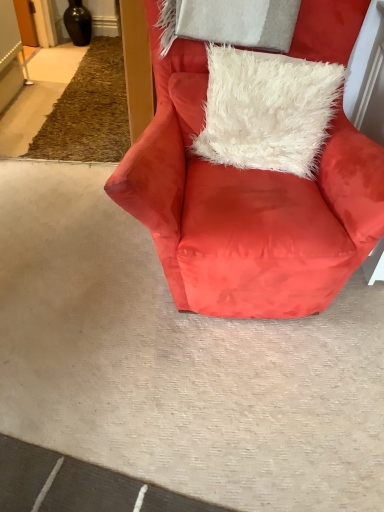
The height and width of the screenshot is (512, 384). Identify the location of white fluffy pillow at center. (267, 110).

Describe the element at coordinates (267, 110) in the screenshot. I see `white fluffy pillow at center` at that location.

Image resolution: width=384 pixels, height=512 pixels. What do you see at coordinates (246, 206) in the screenshot?
I see `satin red armchair at center` at bounding box center [246, 206].

Find the location of a particular element. This screenshot has height=512, width=384. satin red armchair at center is located at coordinates (246, 206).

Measure the distance between point (372, 157) and camera.

1.25 meters.

Where is `white fluffy pillow at center`? This screenshot has height=512, width=384. white fluffy pillow at center is located at coordinates (267, 110).

Is white fluffy pillow at center at the right side of satin red armchair at center?

Yes.

Considering the positions of objects white fluffy pillow at center and satin red armchair at center in the image provided, who is in front, white fluffy pillow at center or satin red armchair at center?

satin red armchair at center is in front.

Is point (308, 137) in front of point (377, 208)?

No, (308, 137) is behind (377, 208).

From the image's perspective, which one is positioned lower, white fluffy pillow at center or satin red armchair at center?

From the image's view, satin red armchair at center is below.

Looking at this image, from a real-world perspective, which object rests below the other?

satin red armchair at center is physically lower.

Is white fluffy pillow at center wider than satin red armchair at center?

No.

In the scene shown: Is white fluffy pillow at center shorter than satin red armchair at center?

Yes.

Between white fluffy pillow at center and satin red armchair at center, which one has smaller size?

Smaller between the two is white fluffy pillow at center.

Consider the image. Is white fluffy pillow at center completely or partially outside of satin red armchair at center?

That's incorrect, white fluffy pillow at center is not completely outside satin red armchair at center.

Is white fluffy pillow at center placed right next to satin red armchair at center?

white fluffy pillow at center and satin red armchair at center are clearly separated.

Is white fluffy pillow at center looking in the opposite direction of satin red armchair at center?

Yes, white fluffy pillow at center's orientation is away from satin red armchair at center.

The width and height of the screenshot is (384, 512). I want to click on chair in front of the white fluffy pillow at center, so click(x=246, y=206).

Is satin red armchair at center at the right side of white fluffy pillow at center?

No, satin red armchair at center is not to the right of white fluffy pillow at center.

Is the depth of satin red armchair at center greater than that of white fluffy pillow at center?

No, satin red armchair at center is closer to the camera.

Which point is more distant from viewer, (155, 243) or (312, 85)?

The point (312, 85) is farther from the camera.

From the image's perspective, relative to white fluffy pillow at center, is satin red armchair at center above or below?

Clearly, from the image's perspective, satin red armchair at center is below white fluffy pillow at center.

From a real-world perspective, relative to white fluffy pillow at center, is satin red armchair at center vertically above or below?

satin red armchair at center is situated lower than white fluffy pillow at center in the real world.

Considering the sizes of objects satin red armchair at center and white fluffy pillow at center in the image provided, who is wider, satin red armchair at center or white fluffy pillow at center?

Wider between the two is satin red armchair at center.

Can you confirm if satin red armchair at center is taller than white fluffy pillow at center?

Yes, satin red armchair at center is taller than white fluffy pillow at center.

Which of these two, satin red armchair at center or white fluffy pillow at center, is smaller?

white fluffy pillow at center is smaller.

From the picture: Does satin red armchair at center contain white fluffy pillow at center?

That's correct, white fluffy pillow at center is inside satin red armchair at center.

Is satin red armchair at center next to white fluffy pillow at center and touching it?

satin red armchair at center is not next to white fluffy pillow at center, and they're not touching.

From the picture: Could you tell me if satin red armchair at center is facing white fluffy pillow at center?

Yes, satin red armchair at center faces towards white fluffy pillow at center.

How much distance is there between satin red armchair at center and white fluffy pillow at center?

The distance of satin red armchair at center from white fluffy pillow at center is 7.56 inches.

The width and height of the screenshot is (384, 512). Identify the location of chair in front of the white fluffy pillow at center. (246, 206).

The image size is (384, 512). I want to click on chair lying on the left of white fluffy pillow at center, so click(x=246, y=206).

Image resolution: width=384 pixels, height=512 pixels. In order to click on pillow behind the satin red armchair at center in this screenshot , I will do (x=267, y=110).